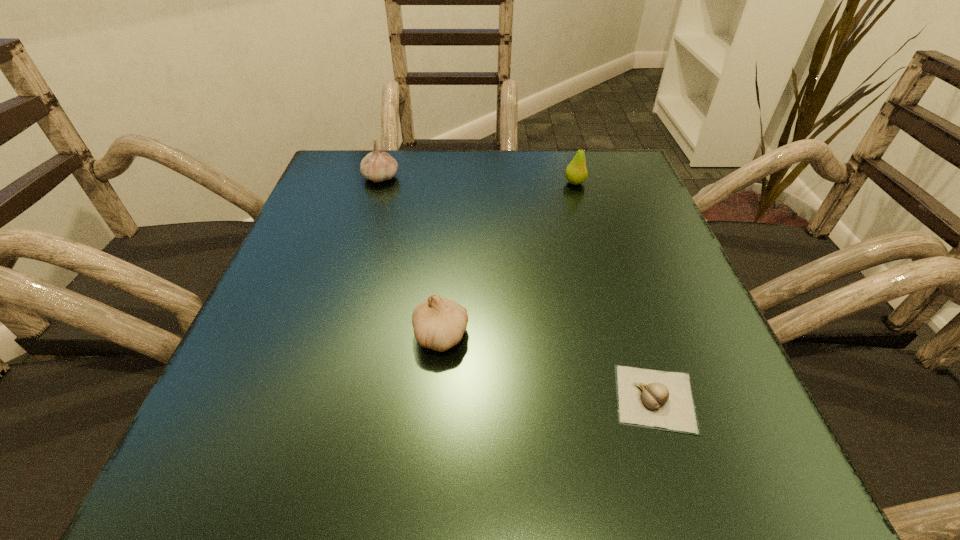
The height and width of the screenshot is (540, 960). Identify the location of blank space located 0.220m on the back of the nearest garlic. (612, 264).

Find the location of a particular element. The width and height of the screenshot is (960, 540). pear that is at the far edge is located at coordinates (576, 172).

This screenshot has width=960, height=540. Find the location of `garlic present at the far edge`. garlic present at the far edge is located at coordinates (377, 166).

Image resolution: width=960 pixels, height=540 pixels. Find the location of `object that is positioned at the near edge`. object that is positioned at the near edge is located at coordinates (663, 400).

Find the location of a particular element. The width and height of the screenshot is (960, 540). object present at the left edge is located at coordinates (377, 166).

At what (x,y) coordinates should I click in order to perform the action: click on pear present at the right edge. Please return your answer as a coordinate pair (x, y). This screenshot has height=540, width=960. Looking at the image, I should click on (576, 172).

Identify the location of garlic situated at the right edge. (663, 400).

The height and width of the screenshot is (540, 960). In order to click on object located in the far left corner section of the desktop in this screenshot , I will do `click(377, 166)`.

Find the location of a particular element. The height and width of the screenshot is (540, 960). object at the far right corner is located at coordinates (576, 172).

You are a GUI agent. You are given a task and a screenshot of the screen. Output one action in this format:
    pyautogui.click(x=<x>, y=<y>)
    Task: Click on the object positioned at the near right corner
    This screenshot has width=960, height=540.
    Given the screenshot: What is the action you would take?
    pyautogui.click(x=663, y=400)